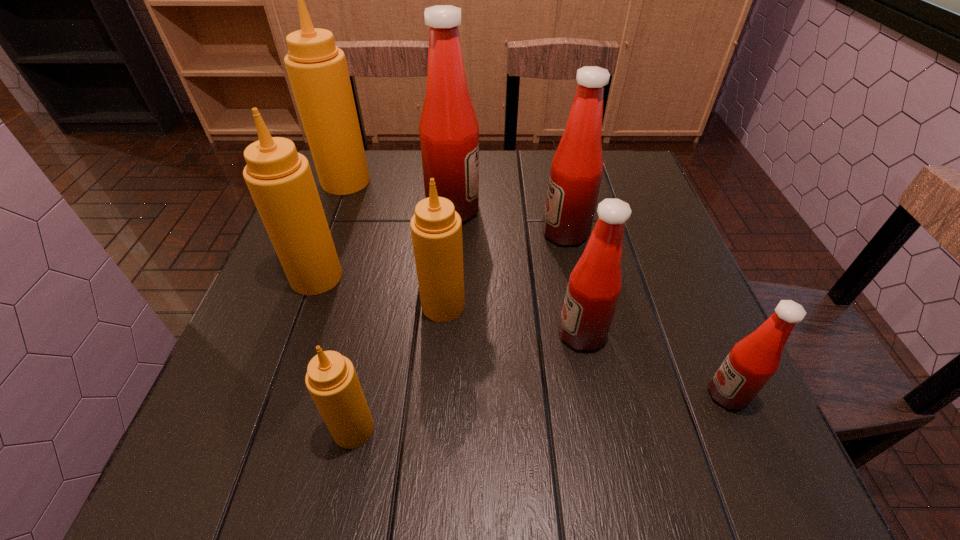
Locate an element on the screen. vacant space that satisfies the following two spatial constraints: 1. on the back side of the rightmost tan condiment; 2. on the right side of the sixth condiment from right to left is located at coordinates (379, 306).